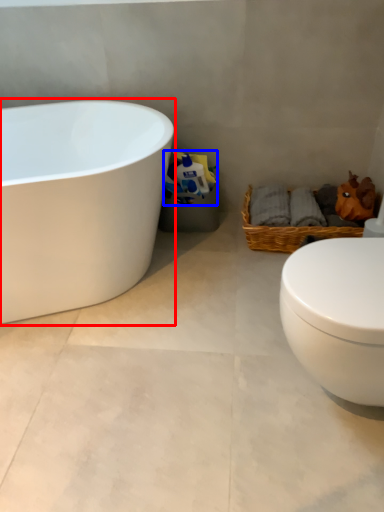
Question: Which of the following is the farthest to the observer, bathtub (highlighted by a red box) or toilet paper (highlighted by a blue box)?

Choices:
 (A) bathtub
 (B) toilet paper

Answer: (B)